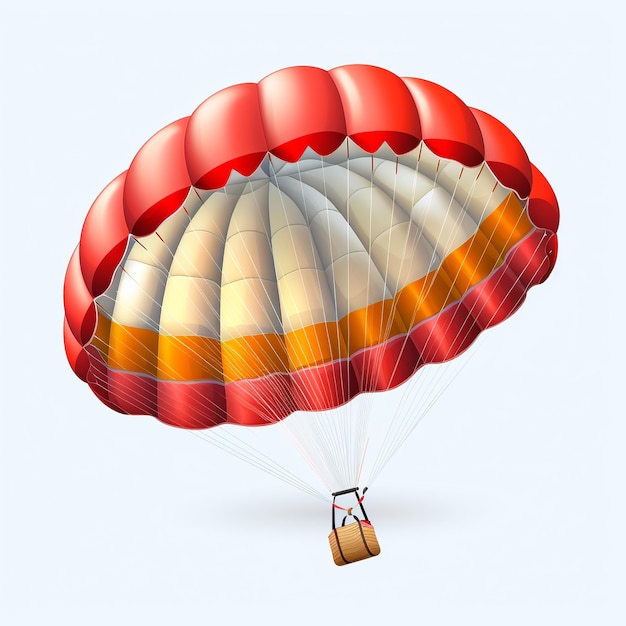
The height and width of the screenshot is (626, 626). Identify the location of cable. (399, 399).